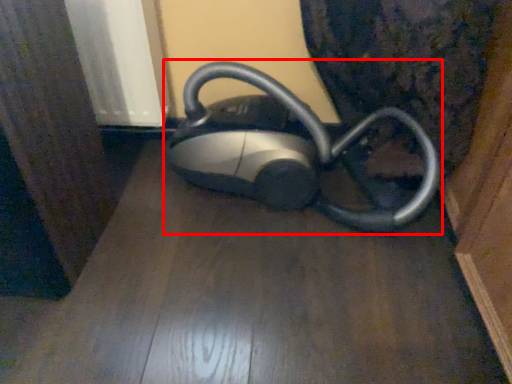
Question: From the image, what is the correct spatial relationship of home appliance (annotated by the red box) in relation to surface?

Choices:
 (A) right
 (B) left

Answer: (A)